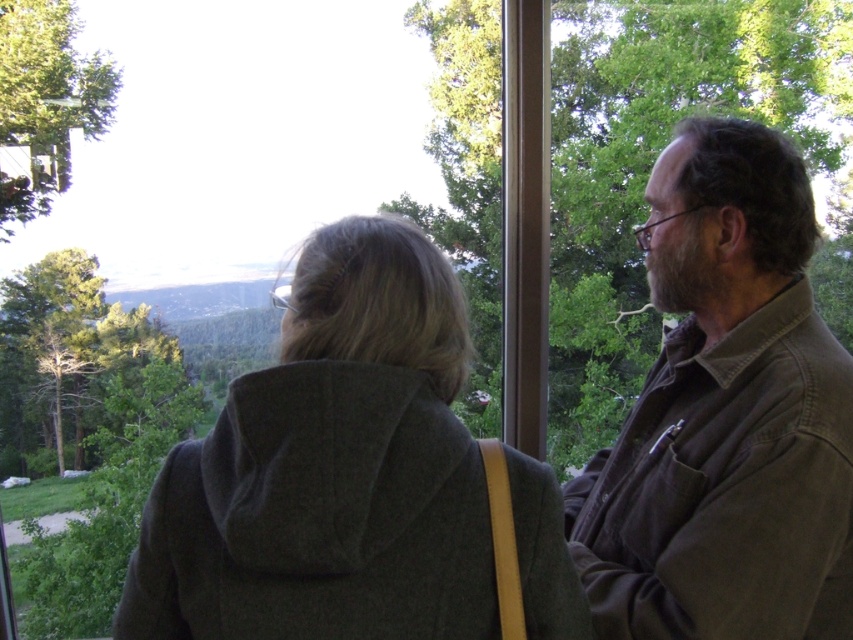
Question: Which point is closer to the camera?

Choices:
 (A) dark gray wool hoodie at center
 (B) brown cotton shirt at right

Answer: (A)

Question: Does dark gray wool hoodie at center have a lesser width compared to brown cotton shirt at right?

Choices:
 (A) yes
 (B) no

Answer: (B)

Question: Is dark gray wool hoodie at center below brown cotton shirt at right?

Choices:
 (A) yes
 (B) no

Answer: (A)

Question: Which of the following is the closest to the observer?

Choices:
 (A) (238, 608)
 (B) (698, 464)

Answer: (A)

Question: Is dark gray wool hoodie at center positioned at the back of brown cotton shirt at right?

Choices:
 (A) no
 (B) yes

Answer: (A)

Question: Which object is farther from the camera taking this photo?

Choices:
 (A) dark gray wool hoodie at center
 (B) brown cotton shirt at right

Answer: (B)